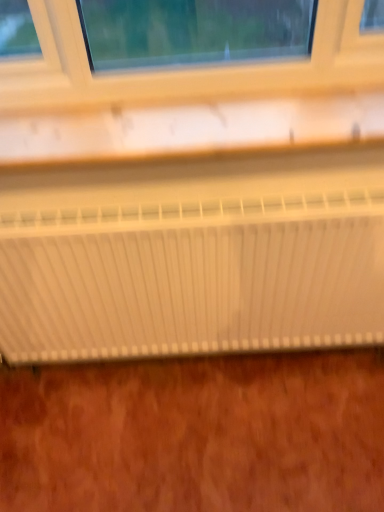
Identify the location of free point below white ribbed radiator at lower center (from a real-world perspective). (163, 358).